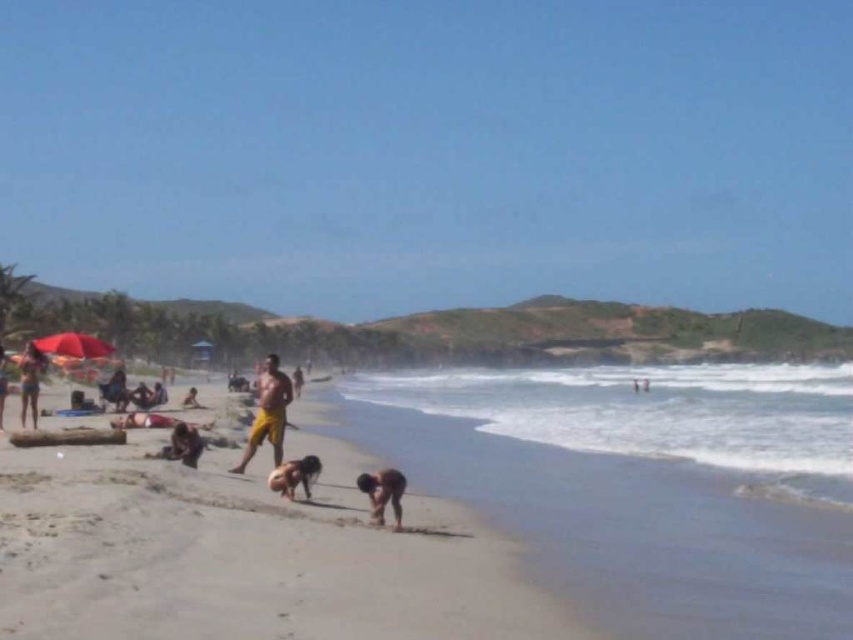
Describe the element at coordinates (268, 412) in the screenshot. The width and height of the screenshot is (853, 640). I see `yellow matte shorts at center` at that location.

Who is more distant from viewer, (277, 428) or (184, 429)?

Point (184, 429)

Image resolution: width=853 pixels, height=640 pixels. Describe the element at coordinates (268, 412) in the screenshot. I see `yellow matte shorts at center` at that location.

Identify the location of yellow matte shorts at center. (268, 412).

Is dark brown skin at lower center smaller than brown fur dog at lower center?

Yes, dark brown skin at lower center is smaller than brown fur dog at lower center.

This screenshot has height=640, width=853. Describe the element at coordinates (381, 493) in the screenshot. I see `dark brown skin at lower center` at that location.

Locate an element on the screen. The height and width of the screenshot is (640, 853). dark brown skin at lower center is located at coordinates (381, 493).

Where is `dark brown skin at lower center`? dark brown skin at lower center is located at coordinates (381, 493).

Can you confirm if light brown sand at center is thinner than dark brown skin at lower center?

In fact, light brown sand at center might be wider than dark brown skin at lower center.

Who is more forward, (311, 392) or (393, 481)?

Positioned in front is point (393, 481).

Where is `light brown sand at center`? light brown sand at center is located at coordinates (244, 552).

You are a GUI agent. You are given a task and a screenshot of the screen. Output one action in this format:
    pyautogui.click(x=<x>, y=<y>)
    Task: Click on the light brown sand at center
    The image size is (853, 640).
    Given the screenshot: What is the action you would take?
    pyautogui.click(x=244, y=552)